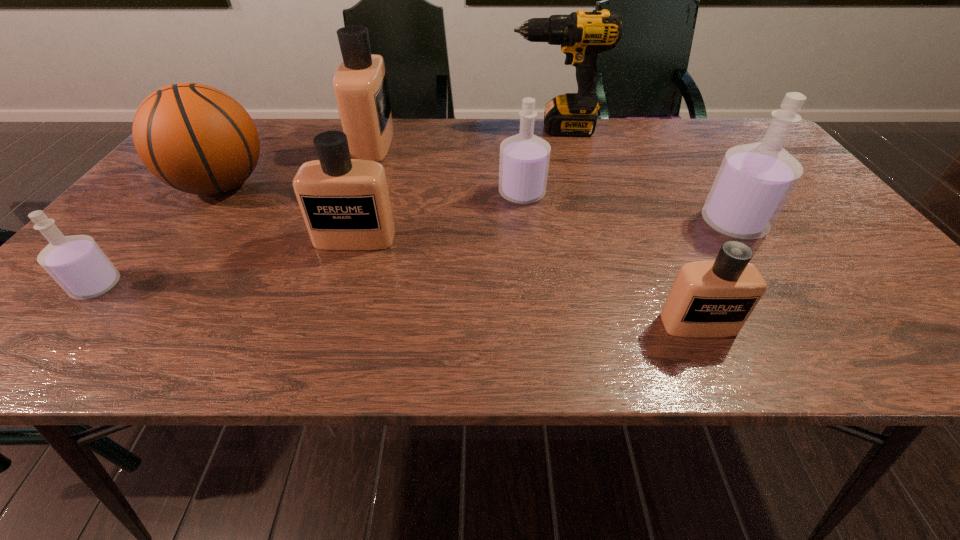
I want to click on vacant area between the biggest purple perfume and the second smallest beige perfume, so click(544, 231).

In order to click on blank region between the smallest purple perfume and the nearest object in this screenshot , I will do `click(397, 305)`.

The width and height of the screenshot is (960, 540). What are the coordinates of `object identified as the third closest to the biggest purple perfume` in the screenshot? It's located at (582, 35).

Locate an element on the screen. object that is the fifth closest one to the second biggest beige perfume is located at coordinates (582, 35).

The height and width of the screenshot is (540, 960). Find the location of `perfume that can be found as the second closest to the smallest purple perfume`. perfume that can be found as the second closest to the smallest purple perfume is located at coordinates (360, 85).

At what (x,y) coordinates should I click in order to perform the action: click on perfume object that ranks as the third closest to the drill. Please return your answer as a coordinate pair (x, y). Looking at the image, I should click on (754, 182).

You are a GUI agent. You are given a task and a screenshot of the screen. Output one action in this format:
    pyautogui.click(x=<x>, y=<y>)
    Task: Click on the beige perfume that is the second nearest to the brown basketball
    
    Given the screenshot: What is the action you would take?
    pyautogui.click(x=345, y=203)

I want to click on the closest beige perfume relative to the fifth farthest perfume, so click(x=345, y=203).

Locate which purple perfume ranks second in proximity to the farthest perfume. Please provide its 2D coordinates. Your answer should be formatted as a tuple, i.e. [(x, y)], where the tuple contains the x and y coordinates of a point satisfying the conditions above.

[(80, 267)]

Select which purple perfume is the second closest to the second smallest purple perfume. Please provide its 2D coordinates. Your answer should be formatted as a tuple, i.e. [(x, y)], where the tuple contains the x and y coordinates of a point satisfying the conditions above.

[(80, 267)]